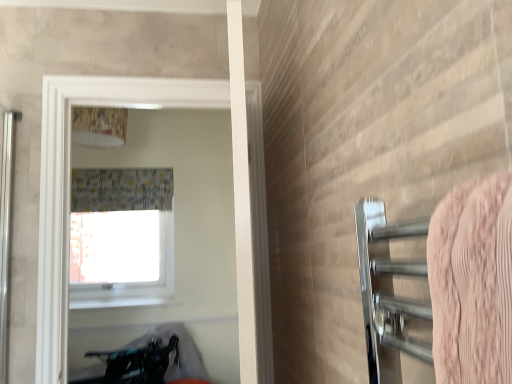
What is the approximate height of white glossy window at upper center?

The height of white glossy window at upper center is 1.20 meters.

The image size is (512, 384). What do you see at coordinates (472, 282) in the screenshot?
I see `pink textured towel at right` at bounding box center [472, 282].

What is the approximate height of white glossy lampshade at upper center?

It is 9.62 inches.

Find the location of a particular element. The height and width of the screenshot is (384, 512). white glossy window at upper center is located at coordinates (68, 185).

Based on the photo, can you tell me how much gray fabric shower curtain at upper center and white glossy lampshade at upper center differ in facing direction?

The facing directions of gray fabric shower curtain at upper center and white glossy lampshade at upper center are 0.0789 degrees apart.

Is gray fabric shower curtain at upper center in front of or behind white glossy lampshade at upper center in the image?

Clearly, gray fabric shower curtain at upper center is in front of white glossy lampshade at upper center.

Are gray fabric shower curtain at upper center and white glossy lampshade at upper center making contact?

gray fabric shower curtain at upper center and white glossy lampshade at upper center are clearly separated.

Is point (154, 177) closer to camera compared to point (90, 114)?

No, it is behind (90, 114).

Is gray fabric shower curtain at upper center turned away from pink textured towel at right?

No, gray fabric shower curtain at upper center is not facing away from pink textured towel at right.

Are gray fabric shower curtain at upper center and pink textured towel at right making contact?

They are not placed beside each other.

From the image's perspective, which is above, gray fabric shower curtain at upper center or pink textured towel at right?

gray fabric shower curtain at upper center, from the image's perspective.

Between gray fabric shower curtain at upper center and pink textured towel at right, which one has more height?

Standing taller between the two is gray fabric shower curtain at upper center.

Where is `screen door that appears below the white glossy lampshade at upper center (from the image's perspective)`? This screenshot has height=384, width=512. screen door that appears below the white glossy lampshade at upper center (from the image's perspective) is located at coordinates (68, 185).

Considering the positions of objects white glossy lampshade at upper center and white glossy window at upper center in the image provided, who is more to the left, white glossy lampshade at upper center or white glossy window at upper center?

white glossy lampshade at upper center.

Is point (79, 130) positioned behind point (55, 150)?

Yes, point (79, 130) is farther from viewer.

Considering their positions, is white glossy lampshade at upper center located in front of or behind white glossy window at upper center?

Clearly, white glossy lampshade at upper center is behind white glossy window at upper center.

What's the angular difference between gray fabric shower curtain at upper center and transparent glass window at upper center's facing directions?

The angular difference between gray fabric shower curtain at upper center and transparent glass window at upper center is 0.44 degrees.

Which is closer, (104, 176) or (150, 250)?

The point (104, 176) is in front.

Is gray fabric shower curtain at upper center closer to the viewer compared to transparent glass window at upper center?

Yes, it is.

Is gray fabric shower curtain at upper center bigger than transparent glass window at upper center?

Correct, gray fabric shower curtain at upper center is larger in size than transparent glass window at upper center.

Is pink textured towel at right completely or partially inside transparent glass window at upper center?

No, transparent glass window at upper center does not contain pink textured towel at right.

Who is smaller, transparent glass window at upper center or pink textured towel at right?

pink textured towel at right is smaller.

Does transparent glass window at upper center appear on the right side of pink textured towel at right?

Incorrect, transparent glass window at upper center is not on the right side of pink textured towel at right.

Between point (70, 257) and point (490, 330), which one is positioned in front?

The point (490, 330) is more forward.

Considering the sizes of objects pink textured towel at right and white glossy window at upper center in the image provided, who is thinner, pink textured towel at right or white glossy window at upper center?

white glossy window at upper center is thinner.

Can you see pink textured towel at right touching white glossy window at upper center?

No, pink textured towel at right is not with white glossy window at upper center.

In terms of height, does pink textured towel at right look taller or shorter compared to white glossy window at upper center?

Clearly, pink textured towel at right is shorter compared to white glossy window at upper center.

Can you confirm if pink textured towel at right is positioned to the left of white glossy window at upper center?

In fact, pink textured towel at right is to the right of white glossy window at upper center.

Does white glossy lampshade at upper center come in front of gray fabric shower curtain at upper center?

No, the depth of white glossy lampshade at upper center is greater than that of gray fabric shower curtain at upper center.

Based on their sizes in the image, would you say white glossy lampshade at upper center is bigger or smaller than gray fabric shower curtain at upper center?

In the image, white glossy lampshade at upper center appears to be smaller than gray fabric shower curtain at upper center.

Does white glossy lampshade at upper center have a greater width compared to gray fabric shower curtain at upper center?

In fact, white glossy lampshade at upper center might be narrower than gray fabric shower curtain at upper center.

From a real-world perspective, is white glossy lampshade at upper center positioned over gray fabric shower curtain at upper center based on gravity?

Indeed, from a real-world perspective, white glossy lampshade at upper center stands above gray fabric shower curtain at upper center.

Where is `shower curtain on the right side of white glossy lampshade at upper center`? shower curtain on the right side of white glossy lampshade at upper center is located at coordinates (121, 189).

Where is `shower curtain above the pink textured towel at right (from a real-world perspective)`? shower curtain above the pink textured towel at right (from a real-world perspective) is located at coordinates (121, 189).

Looking at the image, which one is located closer to gray fabric shower curtain at upper center, pink textured towel at right or transparent glass window at upper center?

transparent glass window at upper center is positioned closer to the anchor gray fabric shower curtain at upper center.

Which object lies further to the anchor point white glossy lampshade at upper center, transparent glass window at upper center or white glossy window at upper center?

Based on the image, transparent glass window at upper center appears to be further to white glossy lampshade at upper center.

Estimate the real-world distances between objects in this image. Which object is closer to transparent glass window at upper center, gray fabric shower curtain at upper center or pink textured towel at right?

Among the two, gray fabric shower curtain at upper center is located nearer to transparent glass window at upper center.

From the image, which object appears to be nearer to gray fabric shower curtain at upper center, white glossy window at upper center or white glossy lampshade at upper center?

white glossy lampshade at upper center.

When comparing their distances from transparent glass window at upper center, does pink textured towel at right or white glossy lampshade at upper center seem further?

pink textured towel at right.

Looking at the image, which one is located further to white glossy lampshade at upper center, gray fabric shower curtain at upper center or transparent glass window at upper center?

transparent glass window at upper center.

Which object lies nearer to the anchor point gray fabric shower curtain at upper center, white glossy lampshade at upper center or transparent glass window at upper center?

transparent glass window at upper center.

Based on their spatial positions, is gray fabric shower curtain at upper center or transparent glass window at upper center closer to white glossy window at upper center?

Among the two, gray fabric shower curtain at upper center is located nearer to white glossy window at upper center.

Identify the location of shower curtain between white glossy window at upper center and transparent glass window at upper center along the z-axis. Image resolution: width=512 pixels, height=384 pixels. (121, 189).

This screenshot has width=512, height=384. I want to click on shower curtain between pink textured towel at right and transparent glass window at upper center in the front-back direction, so click(121, 189).

Find the location of a particular element. shower curtain between pink textured towel at right and white glossy lampshade at upper center along the z-axis is located at coordinates (121, 189).

Where is `screen door between pink textured towel at right and white glossy lampshade at upper center along the z-axis`? The width and height of the screenshot is (512, 384). screen door between pink textured towel at right and white glossy lampshade at upper center along the z-axis is located at coordinates (68, 185).